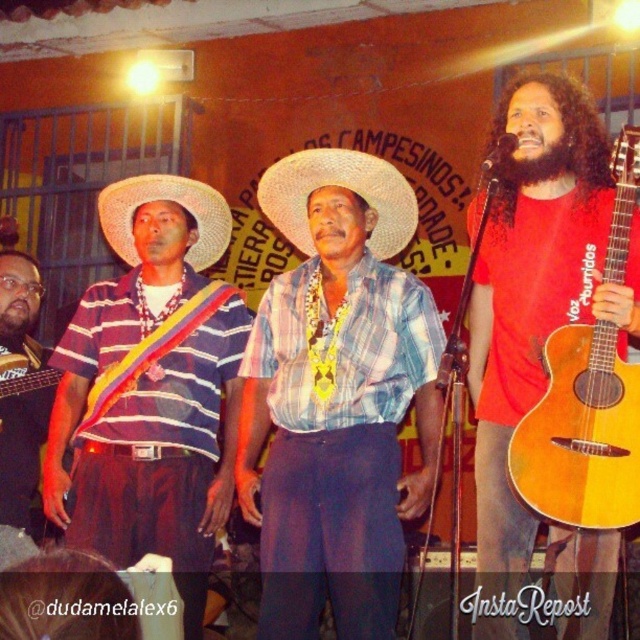
In the scene of the musical performance, there is a white straw hat at center and a striped fabric shirt at left. Which object is covering the other?

The white straw hat at center is positioned over the striped fabric shirt at left, so it is covering the other object.

You are a photographer setting up equipment on stage. You need to position a camera stand between the blue plaid shirt at center and the natural wood acoustic guitar at right. Based on their widths, can the stand fit between them without touching either?

The blue plaid shirt at center might be wider than natural wood acoustic guitar at right, so the camera stand may not fit between them if the total width of both objects exceeds the available space. However, since the exact width difference isn not specified, it is uncertain. Please measure the actual distance before placing the stand.

Please provide the exact 2D coordinates of the blue plaid shirt at center in the image coordinate system.

The blue plaid shirt at center is located at the coordinates point [337,396].